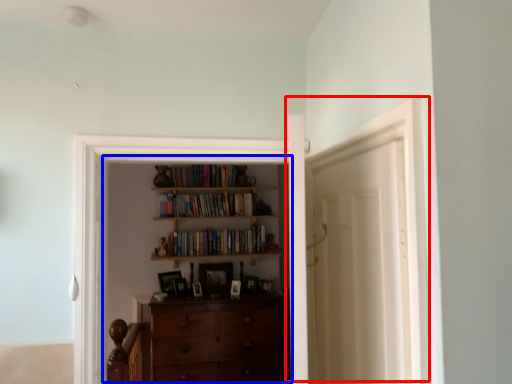
Question: Which point is further to the camera, door (highlighted by a red box) or entertainment center (highlighted by a blue box)?

Choices:
 (A) door
 (B) entertainment center

Answer: (B)